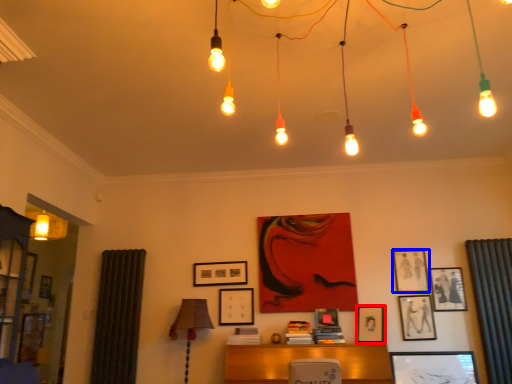
Question: Which object appears closest to the camera in this image, picture frame (highlighted by a red box) or picture frame (highlighted by a blue box)?

Choices:
 (A) picture frame
 (B) picture frame

Answer: (A)